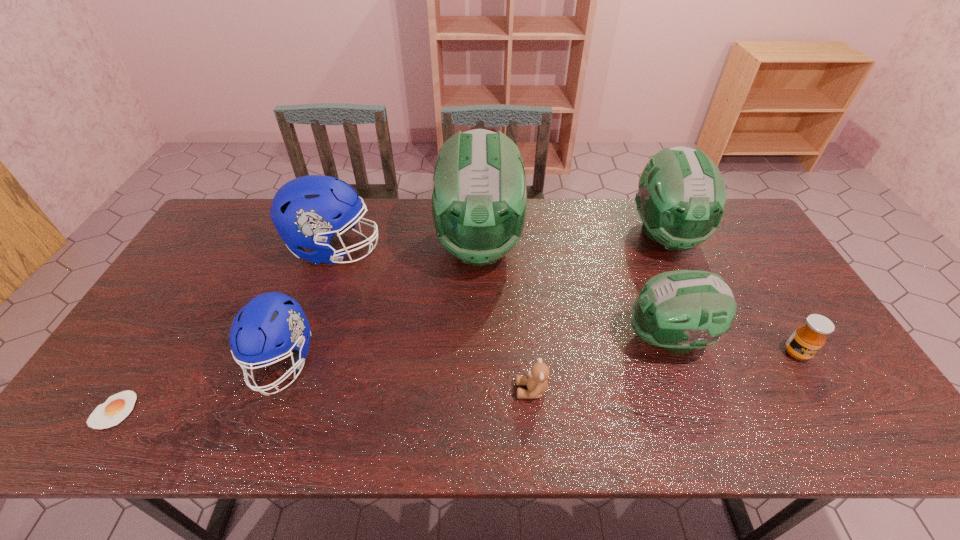
Where is `the leftmost object`? Image resolution: width=960 pixels, height=540 pixels. the leftmost object is located at coordinates (116, 408).

The width and height of the screenshot is (960, 540). What are the coordinates of `the shortest object` in the screenshot? It's located at (116, 408).

This screenshot has height=540, width=960. Identify the location of vacant space positioned 0.350m on the visor of the third football helmet from right to left. (479, 393).

Locate an element on the screen. free region located 0.280m on the visor of the second biggest green football helmet is located at coordinates (713, 341).

Identify the location of vacant space located on the face guard of the farther blue football helmet. The image size is (960, 540). (410, 249).

I want to click on blank area located 0.260m on the visor of the nearest green football helmet, so click(527, 339).

At what (x,y) coordinates should I click in order to perform the action: click on free spot located 0.360m on the visor of the nearest green football helmet. Please return your answer as a coordinate pair (x, y). Image resolution: width=960 pixels, height=540 pixels. Looking at the image, I should click on (489, 339).

Where is `blank area located on the visor of the nearest green football helmet`? This screenshot has width=960, height=540. blank area located on the visor of the nearest green football helmet is located at coordinates (531, 339).

The height and width of the screenshot is (540, 960). I want to click on free space located 0.080m on the face guard of the nearer blue football helmet, so click(254, 435).

Locate an element on the screen. The height and width of the screenshot is (540, 960). free space located on the front-facing side of the sixth tallest object is located at coordinates (851, 441).